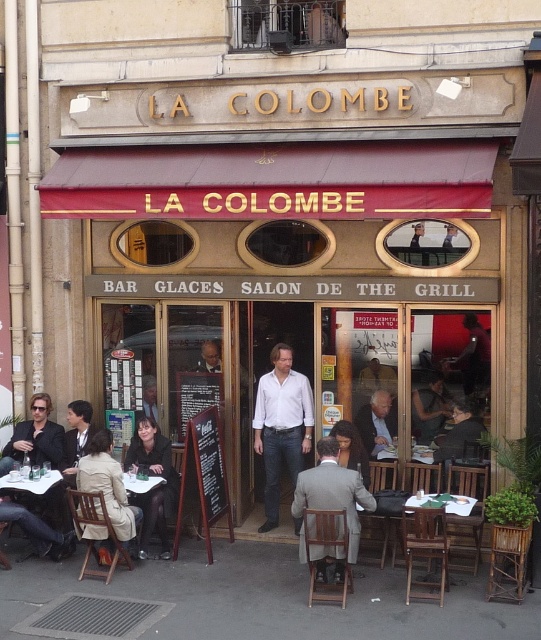
Is point (274, 515) closer to viewer compared to point (423, 504)?

No, (274, 515) is further to viewer.

Does white matte shirt at center appear under wooden table at center?

No, white matte shirt at center is not below wooden table at center.

Which is behind, point (292, 369) or point (483, 515)?

Point (292, 369)

In order to click on white matte shirt at center in this screenshot , I will do `click(281, 426)`.

Does white matte shirt at center come behind dark brown leather jacket at lower left?

Yes, white matte shirt at center is further from the viewer.

Between white matte shirt at center and dark brown leather jacket at lower left, which one appears on the right side from the viewer's perspective?

white matte shirt at center is more to the right.

Image resolution: width=541 pixels, height=640 pixels. What do you see at coordinates (281, 426) in the screenshot?
I see `white matte shirt at center` at bounding box center [281, 426].

Locate an element on the screen. The height and width of the screenshot is (640, 541). white matte shirt at center is located at coordinates (x=281, y=426).

Is the position of gray wool suit at center more distant than that of wooden table at center?

No, gray wool suit at center is closer to the viewer.

Does gray wool suit at center come in front of wooden table at center?

Yes, it is.

Does point (346, 518) come behind point (439, 493)?

No.

Image resolution: width=541 pixels, height=640 pixels. In order to click on gray wool suit at center in this screenshot , I will do `click(333, 500)`.